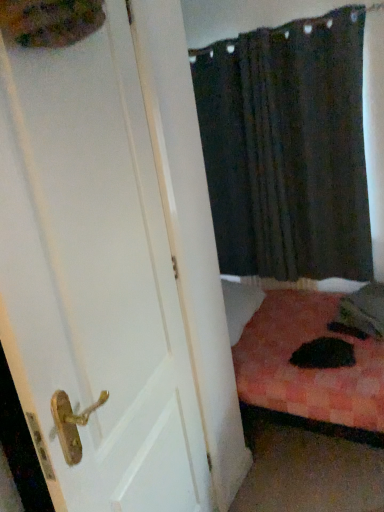
Image resolution: width=384 pixels, height=512 pixels. Describe the element at coordinates (287, 148) in the screenshot. I see `black fabric curtain at upper right` at that location.

Locate an element on the screen. This screenshot has width=384, height=512. black fabric curtain at upper right is located at coordinates (287, 148).

In order to face black fabric curtain at upper right, should I rotate leftwards or rightwards?

It's best to rotate right around 10.732 degrees.

What do you see at coordinates (116, 269) in the screenshot? I see `white wooden door at left` at bounding box center [116, 269].

Identify the location of white wooden door at left. (116, 269).

Locate an element on the screen. Image resolution: width=384 pixels, height=512 pixels. black fabric curtain at upper right is located at coordinates (287, 148).

Would you say white wooden door at left is to the left or to the right of black fabric curtain at upper right in the picture?

white wooden door at left is positioned on black fabric curtain at upper right's left side.

Is white wooden door at left closer to camera compared to black fabric curtain at upper right?

Yes, white wooden door at left is in front of black fabric curtain at upper right.

Does point (23, 288) lie in front of point (351, 50)?

That is True.

From the image's perspective, who appears lower, white wooden door at left or black fabric curtain at upper right?

white wooden door at left.

From a real-world perspective, which object stands above the other?

black fabric curtain at upper right, from a real-world perspective.

Is white wooden door at left wider or thinner than black fabric curtain at upper right?

Clearly, white wooden door at left has less width compared to black fabric curtain at upper right.

Does white wooden door at left have a lesser height compared to black fabric curtain at upper right?

Incorrect, the height of white wooden door at left does not fall short of that of black fabric curtain at upper right.

Can you confirm if white wooden door at left is smaller than black fabric curtain at upper right?

Indeed, white wooden door at left has a smaller size compared to black fabric curtain at upper right.

Based on the photo, would you say white wooden door at left is outside black fabric curtain at upper right?

Yes, white wooden door at left is not within black fabric curtain at upper right.

Can you see white wooden door at left touching black fabric curtain at upper right?

No.

Is white wooden door at left oriented away from black fabric curtain at upper right?

white wooden door at left does not have its back to black fabric curtain at upper right.

You are a GUI agent. You are given a task and a screenshot of the screen. Output one action in this format:
    pyautogui.click(x=<x>, y=<y>)
    Task: Click on the curtain on the right of white wooden door at left
    The image size is (384, 512).
    Given the screenshot: What is the action you would take?
    pyautogui.click(x=287, y=148)

From the picture: Is black fabric curtain at upper right to the left of white wooden door at left from the viewer's perspective?

No.

Relative to white wooden door at left, is black fabric curtain at upper right in front or behind?

Visually, black fabric curtain at upper right is located behind white wooden door at left.

Which is in front, point (254, 135) or point (2, 87)?

Positioned in front is point (2, 87).

From the image's perspective, which one is positioned lower, black fabric curtain at upper right or white wooden door at left?

white wooden door at left appears lower in the image.

From a real-world perspective, between black fabric curtain at upper right and white wooden door at left, who is vertically lower?

From a 3D spatial view, white wooden door at left is below.

Is black fabric curtain at upper right wider or thinner than white wooden door at left?

black fabric curtain at upper right is wider than white wooden door at left.

From their relative heights in the image, would you say black fabric curtain at upper right is taller or shorter than white wooden door at left?

In the image, black fabric curtain at upper right appears to be shorter than white wooden door at left.

Consider the image. Considering the relative sizes of black fabric curtain at upper right and white wooden door at left in the image provided, is black fabric curtain at upper right bigger than white wooden door at left?

Indeed, black fabric curtain at upper right has a larger size compared to white wooden door at left.

Is black fabric curtain at upper right inside or outside of white wooden door at left?

black fabric curtain at upper right exists outside the volume of white wooden door at left.

Is black fabric curtain at upper right next to white wooden door at left and touching it?

They are not placed beside each other.

Is black fabric curtain at upper right aimed at white wooden door at left?

Yes, black fabric curtain at upper right is facing white wooden door at left.

How many degrees apart are the facing directions of black fabric curtain at upper right and white wooden door at left?

They differ by 89.7 degrees in their facing directions.

How much distance is there between black fabric curtain at upper right and white wooden door at left?

black fabric curtain at upper right is 1.24 meters away from white wooden door at left.

I want to click on curtain that is above the white wooden door at left (from the image's perspective), so (287, 148).

Locate an element on the screen. door on the left of the black fabric curtain at upper right is located at coordinates (116, 269).

In order to click on curtain located behind the white wooden door at left in this screenshot , I will do `click(287, 148)`.